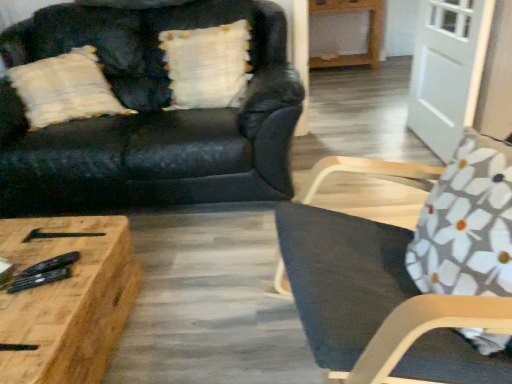
Question: Considering the relative sizes of floral fabric cushion at right and dark gray fabric chair at right in the image provided, is floral fabric cushion at right shorter than dark gray fabric chair at right?

Choices:
 (A) no
 (B) yes

Answer: (B)

Question: Can you confirm if floral fabric cushion at right is thinner than dark gray fabric chair at right?

Choices:
 (A) yes
 (B) no

Answer: (A)

Question: Is floral fabric cushion at right positioned in front of dark gray fabric chair at right?

Choices:
 (A) no
 (B) yes

Answer: (A)

Question: Is the position of floral fabric cushion at right more distant than that of dark gray fabric chair at right?

Choices:
 (A) yes
 (B) no

Answer: (A)

Question: Can you confirm if floral fabric cushion at right is bigger than dark gray fabric chair at right?

Choices:
 (A) no
 (B) yes

Answer: (A)

Question: Is white textured pillow at upper center situated inside white glossy door at upper right or outside?

Choices:
 (A) outside
 (B) inside

Answer: (A)

Question: From the image's perspective, is white textured pillow at upper center located above or below white glossy door at upper right?

Choices:
 (A) below
 (B) above

Answer: (B)

Question: From a real-world perspective, relative to white glossy door at upper right, is white textured pillow at upper center vertically above or below?

Choices:
 (A) above
 (B) below

Answer: (A)

Question: Is white textured pillow at upper center taller or shorter than white glossy door at upper right?

Choices:
 (A) short
 (B) tall

Answer: (A)

Question: From a real-world perspective, relative to dark gray fabric chair at right, is white glossy door at upper right vertically above or below?

Choices:
 (A) below
 (B) above

Answer: (A)

Question: From their relative heights in the image, would you say white glossy door at upper right is taller or shorter than dark gray fabric chair at right?

Choices:
 (A) short
 (B) tall

Answer: (A)

Question: Is white glossy door at upper right wider or thinner than dark gray fabric chair at right?

Choices:
 (A) wide
 (B) thin

Answer: (B)

Question: In terms of size, does white glossy door at upper right appear bigger or smaller than dark gray fabric chair at right?

Choices:
 (A) big
 (B) small

Answer: (B)

Question: Is wooden coffee table at lower left in front of or behind matte black couch at upper left in the image?

Choices:
 (A) front
 (B) behind

Answer: (A)

Question: From the image's perspective, is wooden coffee table at lower left positioned above or below matte black couch at upper left?

Choices:
 (A) below
 (B) above

Answer: (A)